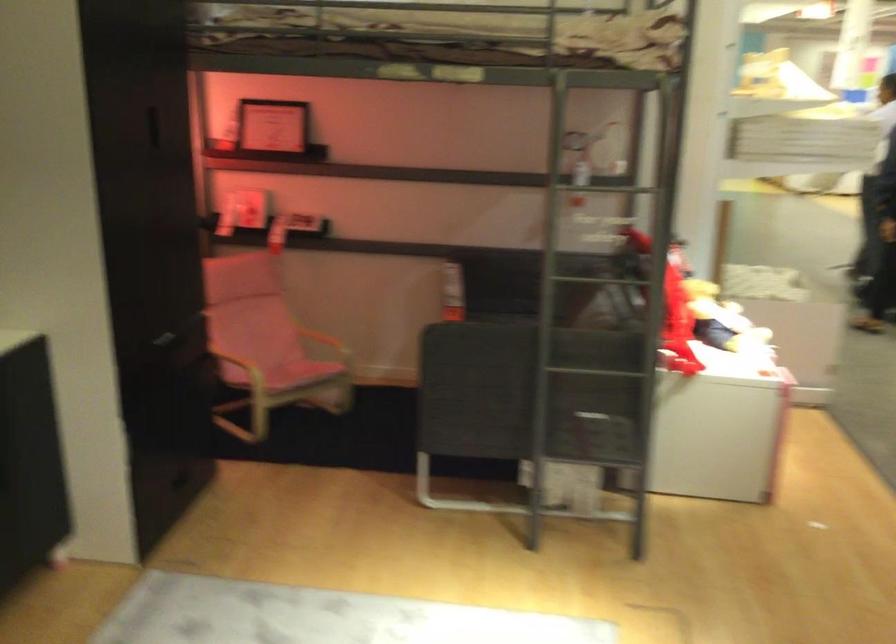
What do you see at coordinates (268, 353) in the screenshot?
I see `the pink chair sitting surface` at bounding box center [268, 353].